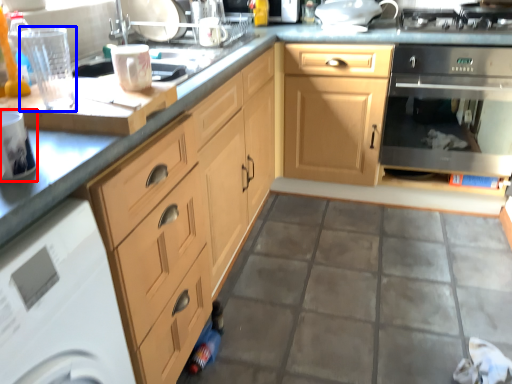
Question: Which point is further to the camera, kitchen appliance (highlighted by a red box) or appliance (highlighted by a blue box)?

Choices:
 (A) kitchen appliance
 (B) appliance

Answer: (B)